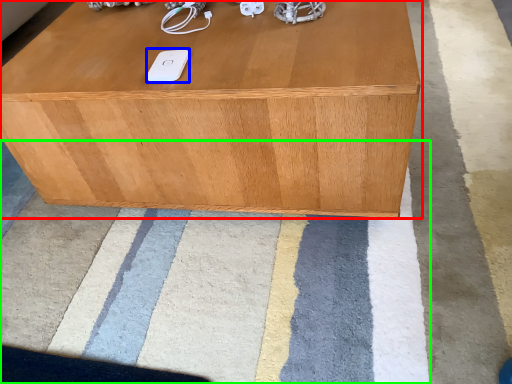
Question: Which object is positioned closest to table (highlighted by a red box)? Select from ipod (highlighted by a blue box) and mat (highlighted by a green box).

Choices:
 (A) ipod
 (B) mat

Answer: (A)